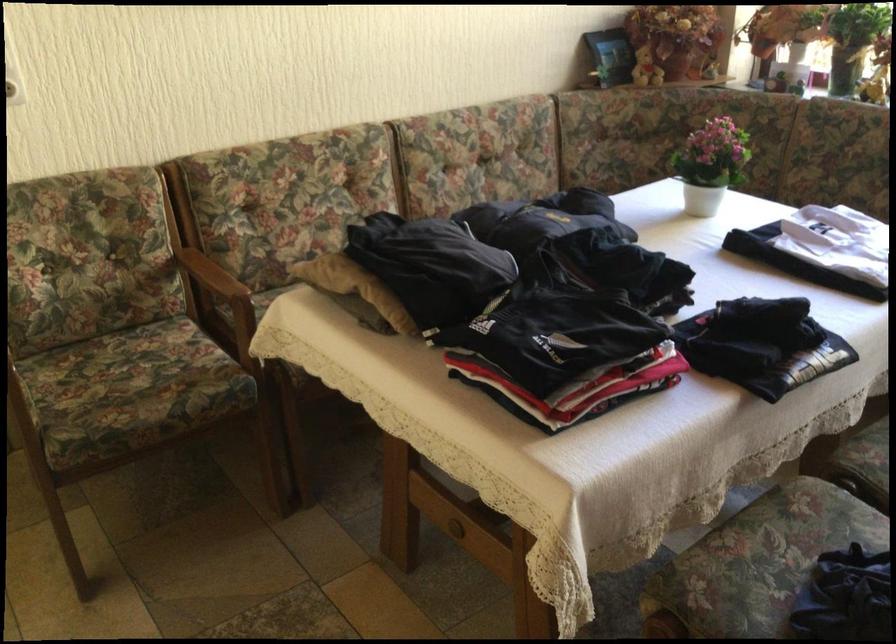
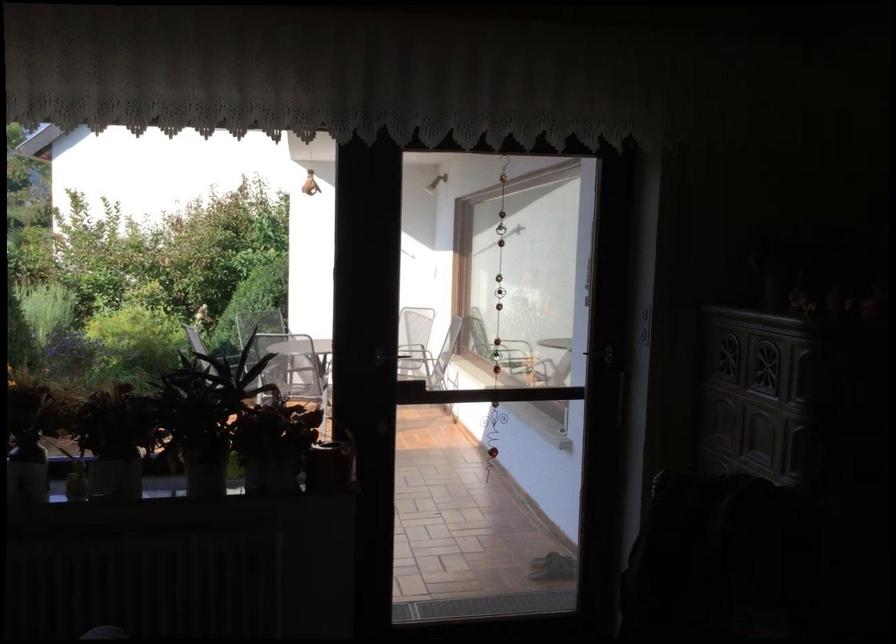
Question: How did the camera likely rotate?

Choices:
 (A) Left
 (B) Right
 (C) Up
 (D) Down

Answer: (B)